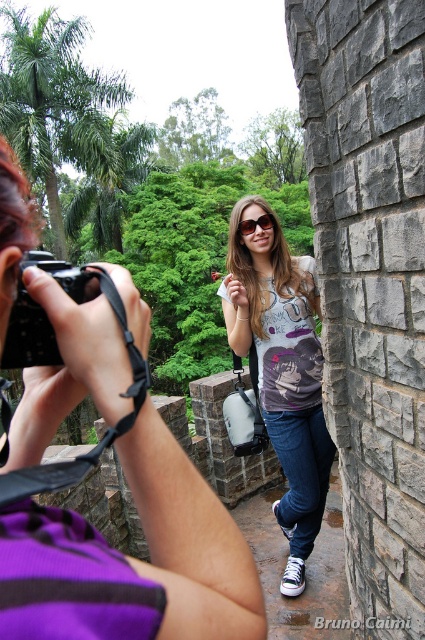
You are a fashion designer analyzing the image. You need to determine which item is wider between the matte purple shirt at center and the matte plastic goggles at center. Which one is wider?

The matte purple shirt at center is wider than the matte plastic goggles at center.